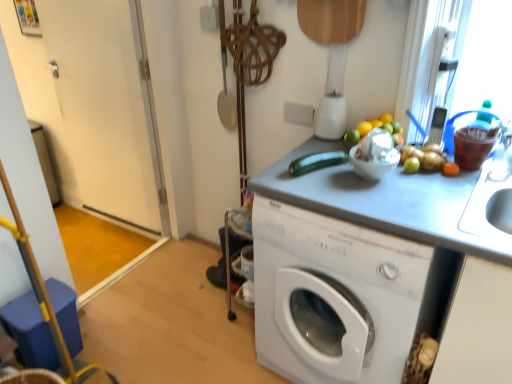
At what (x,y) coordinates should I click in order to perform the action: click on vacant space underneath white glossy door at left (from a real-world perspective). Please return your answer as a coordinate pair (x, y). The height and width of the screenshot is (384, 512). Looking at the image, I should click on (112, 235).